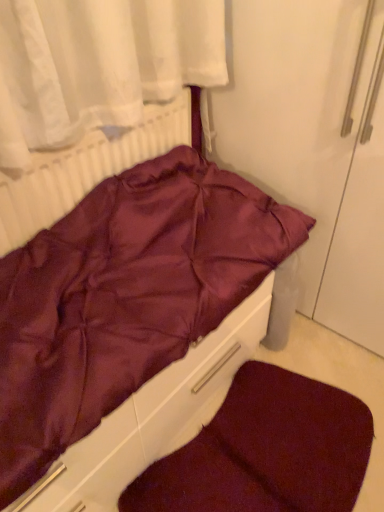
Find the location of a particular element. empty space that is ontop of burgundy plush dog bed at lower center (from a real-world perspective) is located at coordinates (272, 444).